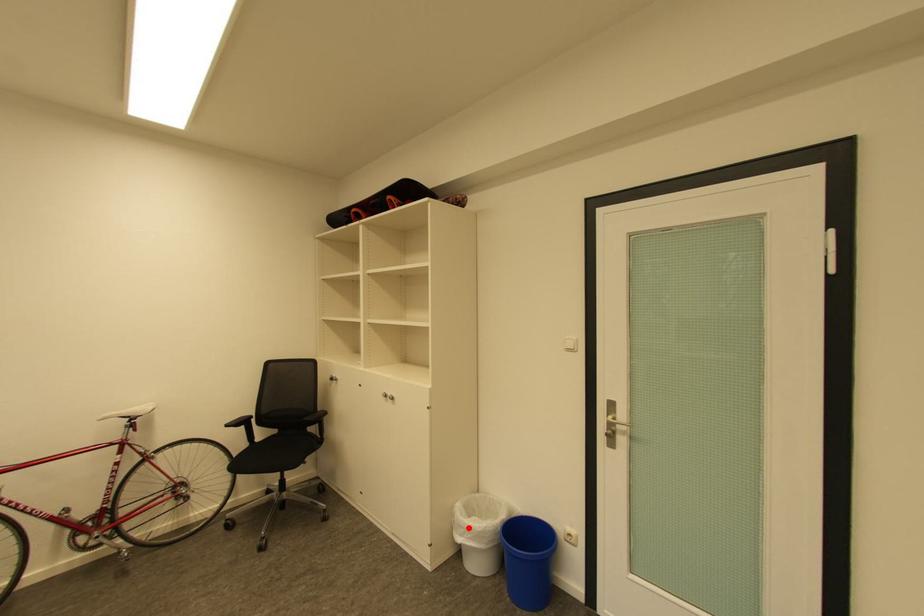
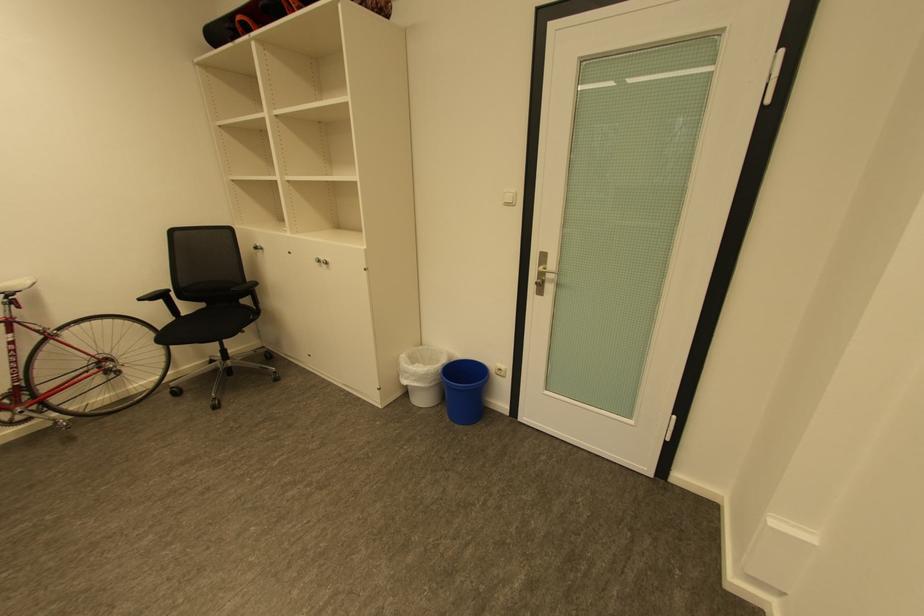
Question: I am providing you with two images of the same scene from different viewpoints. Image1 has a red point marked. In image2, the corresponding 3D location appears at what relative position? Reply with the corresponding letter.

Choices:
 (A) Closer
 (B) Farther

Answer: (A)